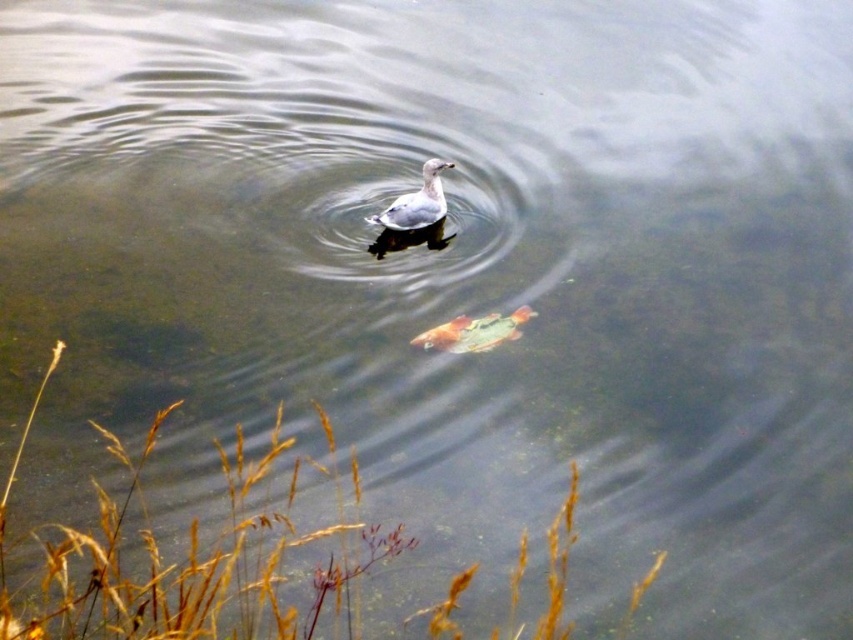
You are standing at the edge of the water and see two points in the scene. One is labeled as point (500,316) and the other as point (442,164). Which point is closer to you?

Point (500,316) is in front of point 0.259, 0.259, so it is closer to you.

You are an aquatic photographer trying to capture both the shiny orange fish at center and the white matte duck at center in a single shot. Based on their sizes, which one should you focus on to ensure both fit in the frame without cropping?

The shiny orange fish at center is larger than the white matte duck at center, so you should focus on the shiny orange fish at center to ensure both fit in the frame without cropping.